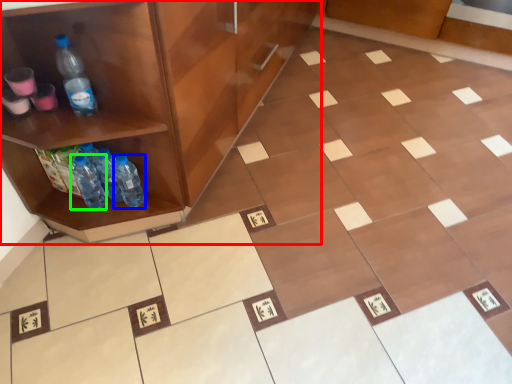
Question: Which object is positioned farthest from cabinetry (highlighted by a red box)? Select from bottle (highlighted by a blue box) and bottle (highlighted by a green box).

Choices:
 (A) bottle
 (B) bottle

Answer: (B)